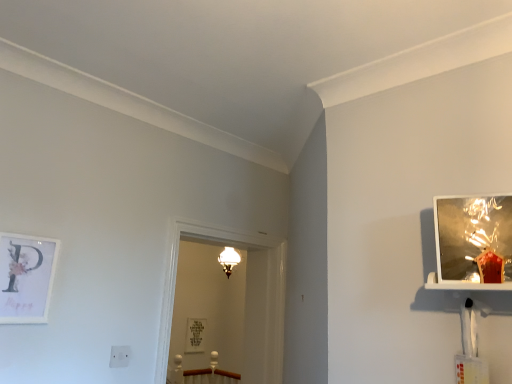
Describe the element at coordinates (26, 277) in the screenshot. The height and width of the screenshot is (384, 512). I see `white matte picture frame at left, which ranks as the third picture frame in right-to-left order` at that location.

Consider the image. What is the approximate height of metallic reflective picture frame at upper right, positioned as the first picture frame in front-to-back order?

It is 10.52 inches.

Image resolution: width=512 pixels, height=384 pixels. I want to click on metallic reflective picture frame at upper right, positioned as the 3th picture frame in back-to-front order, so tap(474, 239).

Identify the location of clear glass door at center. Image resolution: width=512 pixels, height=384 pixels. (245, 302).

Can we say metallic reflective picture frame at upper right, positioned as the 3th picture frame in back-to-front order, lies outside white matte picture frame at left, the 2th picture frame in the bottom-to-top sequence?

Yes, metallic reflective picture frame at upper right, positioned as the 3th picture frame in back-to-front order, is not within white matte picture frame at left, the 2th picture frame in the bottom-to-top sequence.

From the image's perspective, which is below, metallic reflective picture frame at upper right, the third picture frame when ordered from bottom to top, or white matte picture frame at left, which is the second picture frame from top to bottom?

From the image's view, white matte picture frame at left, which is the second picture frame from top to bottom, is below.

From the picture: Is metallic reflective picture frame at upper right, positioned as the 3th picture frame in back-to-front order, aimed at white matte picture frame at left, which is the second picture frame from top to bottom?

No, metallic reflective picture frame at upper right, positioned as the 3th picture frame in back-to-front order, is not turned towards white matte picture frame at left, which is the second picture frame from top to bottom.

From a real-world perspective, is metallic reflective picture frame at upper right, positioned as the first picture frame in front-to-back order, physically located above or below white matte picture frame at left, the 2th picture frame in the bottom-to-top sequence?

In terms of real-world spatial position, metallic reflective picture frame at upper right, positioned as the first picture frame in front-to-back order, is above white matte picture frame at left, the 2th picture frame in the bottom-to-top sequence.

In the scene shown: Which of these two, clear glass door at center or metallic reflective picture frame at upper right, the third picture frame when ordered from bottom to top, is wider?

clear glass door at center.

In terms of size, does clear glass door at center appear bigger or smaller than metallic reflective picture frame at upper right, positioned as the first picture frame in front-to-back order?

Considering their sizes, clear glass door at center takes up more space than metallic reflective picture frame at upper right, positioned as the first picture frame in front-to-back order.

How many degrees apart are the facing directions of clear glass door at center and metallic reflective picture frame at upper right, which ranks as the 3th picture frame in left-to-right order?

clear glass door at center and metallic reflective picture frame at upper right, which ranks as the 3th picture frame in left-to-right order, are facing 66.1 degrees away from each other.

From the image's perspective, which object appears higher, white matte picture frame at left, which is the second picture frame from top to bottom, or matte silver picture frame at center, the third picture frame positioned from the top?

white matte picture frame at left, which is the second picture frame from top to bottom, from the image's perspective.

Is white matte picture frame at left, which is the second picture frame from top to bottom, aimed at matte silver picture frame at center, positioned as the third picture frame in front-to-back order?

No, white matte picture frame at left, which is the second picture frame from top to bottom, is not turned towards matte silver picture frame at center, positioned as the third picture frame in front-to-back order.

From the picture: From a real-world perspective, between white matte picture frame at left, which is the second picture frame from front to back, and matte silver picture frame at center, the third picture frame positioned from the top, who is vertically lower?

From a 3D spatial view, matte silver picture frame at center, the third picture frame positioned from the top, is below.

Between white matte picture frame at left, which ranks as the third picture frame in right-to-left order, and matte silver picture frame at center, which is counted as the second picture frame, starting from the right, which one is positioned behind?

matte silver picture frame at center, which is counted as the second picture frame, starting from the right, is further from the camera.

Which object is positioned more to the right, clear glass door at center or matte white sconce at upper center?

From the viewer's perspective, clear glass door at center appears more on the right side.

Does clear glass door at center turn towards matte white sconce at upper center?

No, clear glass door at center is not turned towards matte white sconce at upper center.

From a real-world perspective, who is located higher, clear glass door at center or matte white sconce at upper center?

matte white sconce at upper center.

Measure the distance from clear glass door at center to matte white sconce at upper center.

clear glass door at center and matte white sconce at upper center are 33.27 inches apart from each other.

From a real-world perspective, which object rests below the other?

In real-world perspective, white matte picture frame at left, which is the second picture frame from top to bottom, is lower.

Does point (20, 322) lie behind point (445, 201)?

Yes, it is.

You are a GUI agent. You are given a task and a screenshot of the screen. Output one action in this format:
    pyautogui.click(x=<x>, y=<y>)
    Task: Click on the picture frame in front of the white matte picture frame at left, the 2th picture frame in the bottom-to-top sequence
    The height and width of the screenshot is (384, 512).
    Given the screenshot: What is the action you would take?
    pyautogui.click(x=474, y=239)

From the image's perspective, is white matte picture frame at left, which is the second picture frame from front to back, below metallic reflective picture frame at upper right, the third picture frame when ordered from bottom to top?

Indeed, from the image's perspective, white matte picture frame at left, which is the second picture frame from front to back, is shown beneath metallic reflective picture frame at upper right, the third picture frame when ordered from bottom to top.

How many degrees apart are the facing directions of matte silver picture frame at center, marked as the first picture frame in a back-to-front arrangement, and white matte picture frame at left, which ranks as the third picture frame in right-to-left order?

There is a 0.272-degree angle between the facing directions of matte silver picture frame at center, marked as the first picture frame in a back-to-front arrangement, and white matte picture frame at left, which ranks as the third picture frame in right-to-left order.

Which object is thinner, matte silver picture frame at center, marked as the first picture frame in a back-to-front arrangement, or white matte picture frame at left, acting as the 2th picture frame starting from the back?

Thinner between the two is matte silver picture frame at center, marked as the first picture frame in a back-to-front arrangement.

Locate an element on the screen. This screenshot has height=384, width=512. picture frame that is the 1st one above the matte silver picture frame at center, marked as the first picture frame in a back-to-front arrangement (from a real-world perspective) is located at coordinates (26, 277).

How many degrees apart are the facing directions of clear glass door at center and matte silver picture frame at center, positioned as the third picture frame in front-to-back order?

0.373 degrees separate the facing orientations of clear glass door at center and matte silver picture frame at center, positioned as the third picture frame in front-to-back order.

Is clear glass door at center to the left or to the right of matte silver picture frame at center, the 1th picture frame when ordered from bottom to top, in the image?

clear glass door at center is to the right of matte silver picture frame at center, the 1th picture frame when ordered from bottom to top.

Is clear glass door at center looking in the opposite direction of matte silver picture frame at center, which appears as the 2th picture frame when viewed from the left?

No, matte silver picture frame at center, which appears as the 2th picture frame when viewed from the left, is not at the back of clear glass door at center.

From a real-world perspective, which object stands above the other?

From a 3D spatial view, clear glass door at center is above.

From the image's perspective, count 1st picture frames downward from the metallic reflective picture frame at upper right, acting as the first picture frame starting from the right, and point to it. Please provide its 2D coordinates.

[(26, 277)]

The width and height of the screenshot is (512, 384). I want to click on picture frame that is the 2nd one when counting upward from the clear glass door at center (from the image's perspective), so click(474, 239).

When comparing their distances from metallic reflective picture frame at upper right, the third picture frame when ordered from bottom to top, does white matte picture frame at left, acting as the 2th picture frame starting from the back, or matte white sconce at upper center seem further?

matte white sconce at upper center.

Considering their positions, is matte white sconce at upper center positioned closer to clear glass door at center than white matte picture frame at left, which is the second picture frame from top to bottom?

matte white sconce at upper center lies closer to clear glass door at center than the other object.

Looking at the image, which one is located closer to matte white sconce at upper center, metallic reflective picture frame at upper right, acting as the first picture frame starting from the right, or matte silver picture frame at center, which is counted as the second picture frame, starting from the right?

matte silver picture frame at center, which is counted as the second picture frame, starting from the right, is positioned closer to the anchor matte white sconce at upper center.

In the scene shown: Which object lies nearer to the anchor point clear glass door at center, matte white sconce at upper center or matte silver picture frame at center, which appears as the 2th picture frame when viewed from the left?

matte white sconce at upper center lies closer to clear glass door at center than the other object.

Estimate the real-world distances between objects in this image. Which object is closer to white matte picture frame at left, which ranks as the third picture frame in right-to-left order, metallic reflective picture frame at upper right, which appears as the 1th picture frame when viewed from the top, or matte silver picture frame at center, positioned as the third picture frame in front-to-back order?

Based on the image, metallic reflective picture frame at upper right, which appears as the 1th picture frame when viewed from the top, appears to be nearer to white matte picture frame at left, which ranks as the third picture frame in right-to-left order.

From the image, which object appears to be nearer to white matte picture frame at left, which is the second picture frame from top to bottom, matte silver picture frame at center, the third picture frame positioned from the top, or matte white sconce at upper center?

matte white sconce at upper center.

Based on the photo, which object lies nearer to the anchor point metallic reflective picture frame at upper right, the third picture frame when ordered from bottom to top, clear glass door at center or matte white sconce at upper center?

clear glass door at center is closer to metallic reflective picture frame at upper right, the third picture frame when ordered from bottom to top.

When comparing their distances from metallic reflective picture frame at upper right, positioned as the first picture frame in front-to-back order, does white matte picture frame at left, acting as the 2th picture frame starting from the back, or clear glass door at center seem further?

white matte picture frame at left, acting as the 2th picture frame starting from the back, is positioned further to the anchor metallic reflective picture frame at upper right, positioned as the first picture frame in front-to-back order.

Identify the location of glass door located between white matte picture frame at left, which is the second picture frame from top to bottom, and matte white sconce at upper center in the depth direction. coord(245,302).

Identify the location of glass door between white matte picture frame at left, which ranks as the third picture frame in right-to-left order, and matte silver picture frame at center, the 1th picture frame when ordered from bottom to top, along the z-axis. This screenshot has height=384, width=512. (245, 302).

Find the location of a particular element. The image size is (512, 384). glass door situated between white matte picture frame at left, which is the first picture frame in left-to-right order, and metallic reflective picture frame at upper right, acting as the first picture frame starting from the right, from left to right is located at coordinates (245, 302).

The height and width of the screenshot is (384, 512). In order to click on light fixture between clear glass door at center and matte silver picture frame at center, which is counted as the second picture frame, starting from the right, from front to back in this screenshot , I will do `click(229, 260)`.